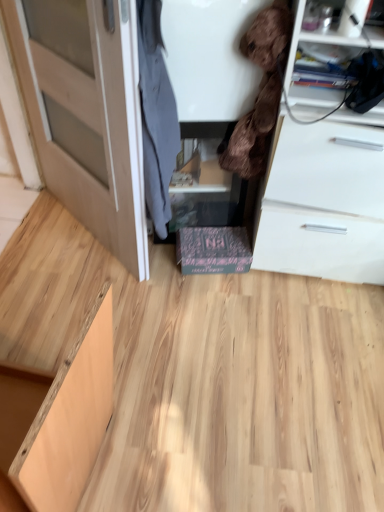
Question: From the image's perspective, is black cardboard box at center, the first cabinetry from the back, above or below dark gray fabric coat at center, which is the 2th clothing from right to left?

Choices:
 (A) above
 (B) below

Answer: (B)

Question: Would you say black cardboard box at center, the first cabinetry from the back, is to the left or to the right of dark gray fabric coat at center, which is the 2th clothing from right to left, in the picture?

Choices:
 (A) left
 (B) right

Answer: (B)

Question: Based on their relative distances, which object is nearer to the light wood cabinet at lower left, which ranks as the first cabinetry in left-to-right order?

Choices:
 (A) light brown wood door at left
 (B) dark gray fabric coat at center, positioned as the 1th clothing in left-to-right order
 (C) natural wood plywood at center
 (D) black cardboard box at center, the first cabinetry from the back
 (E) brown plush toy at upper right, acting as the first clothing starting from the right

Answer: (C)

Question: Which is farther from the brown plush toy at upper right, acting as the first clothing starting from the right?

Choices:
 (A) transparent glass door at left
 (B) light wood cabinet at lower left, acting as the first cabinetry starting from the front
 (C) natural wood plywood at center
 (D) light brown wood door at left
 (E) dark gray fabric coat at center, positioned as the 1th clothing in left-to-right order

Answer: (B)